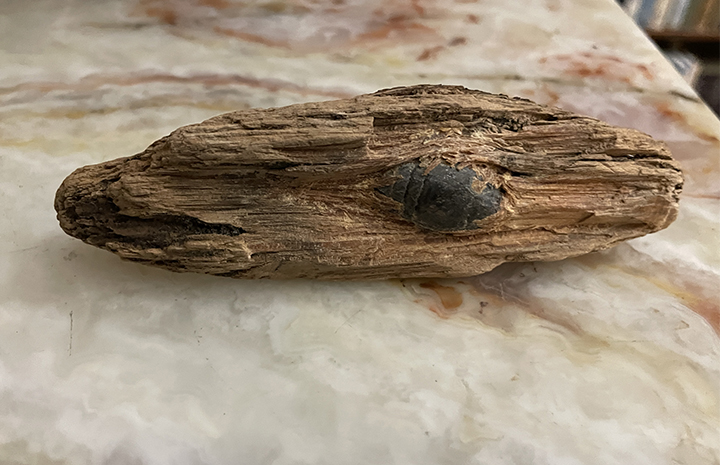
The height and width of the screenshot is (465, 720). Find the location of `table`. table is located at coordinates (389, 368).